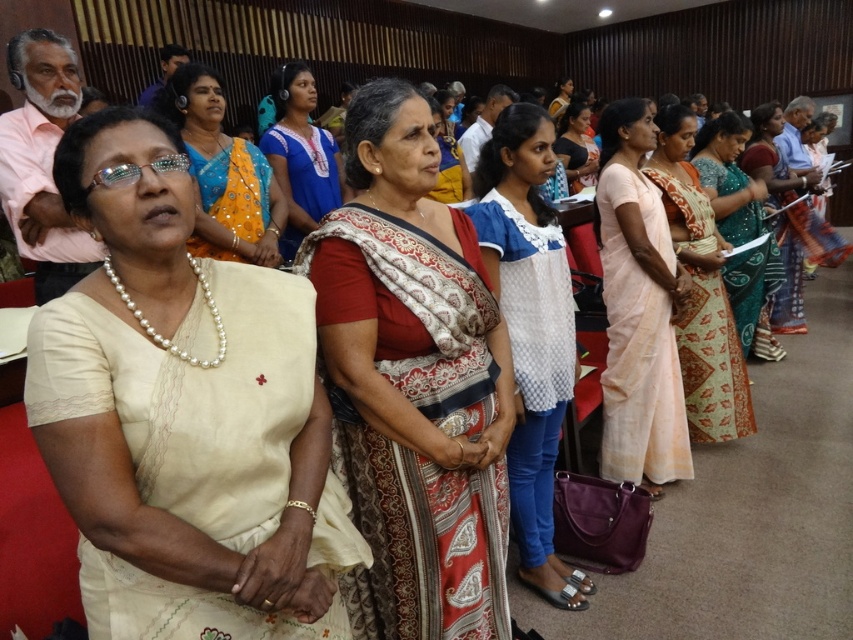
You are an event planner arranging a photo shoot in this room. You need to position a backdrop exactly at the center of the room. The backdrop is 1.2 meters wide. The red and white patterned saree at center is currently occupying the center. Can you place the backdrop without moving the saree?

The red and white patterned saree at center is located at point (412, 381), which is not exactly at the center of the room. Therefore, you can place the backdrop at the true center without moving the saree.

From the picture: You are an event planner arranging a photo shoot in the described setting. You need to position a spotlight exactly at point [183,413]. Which object should the spotlight be directed towards?

The spotlight should be directed towards the matte cream blouse at center located at point [183,413].